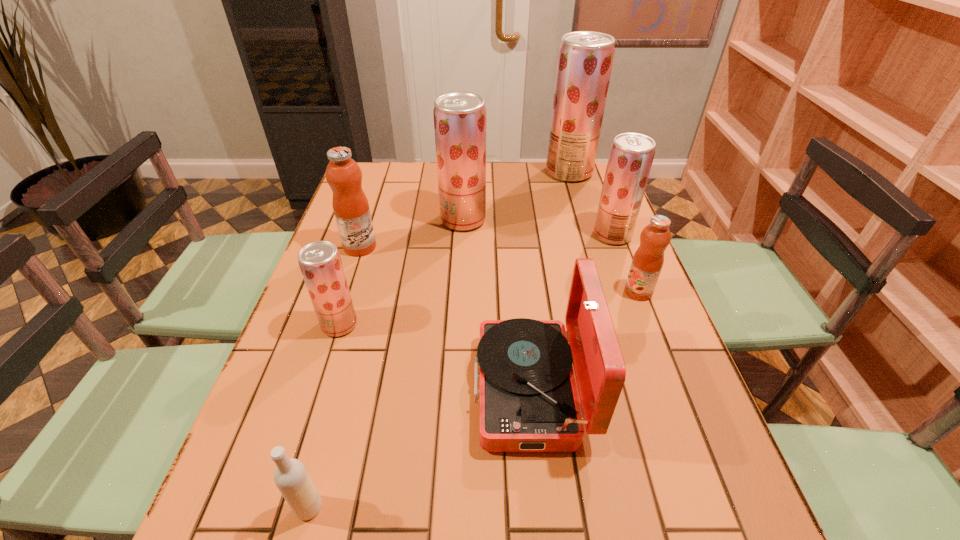
Where is `the nearer orange fruit juice`? the nearer orange fruit juice is located at coordinates (648, 260).

Where is `the smaller orange fruit juice`? The width and height of the screenshot is (960, 540). the smaller orange fruit juice is located at coordinates (648, 260).

Image resolution: width=960 pixels, height=540 pixels. I want to click on the nearest object, so click(x=291, y=477).

Locate an element on the screen. Image resolution: width=960 pixels, height=540 pixels. the shortest object is located at coordinates (291, 477).

Locate an element on the screen. The height and width of the screenshot is (540, 960). vacant space located 0.280m on the left of the tallest object is located at coordinates (469, 172).

The height and width of the screenshot is (540, 960). I want to click on vacant region located on the left of the second tallest fruit juice, so click(387, 220).

At what (x,y) coordinates should I click in order to perform the action: click on vacant position located on the back of the third biggest strawberry fruit juice. Please return your answer as a coordinate pair (x, y). This screenshot has height=540, width=960. Looking at the image, I should click on (587, 167).

Where is `free space located on the front label of the farther orange fruit juice`? free space located on the front label of the farther orange fruit juice is located at coordinates (500, 247).

This screenshot has height=540, width=960. I want to click on vacant position located 0.290m on the front-facing side of the phonograph_record, so click(337, 389).

Locate an element on the screen. The height and width of the screenshot is (540, 960). vacant space located 0.300m on the front-facing side of the phonograph_record is located at coordinates (332, 389).